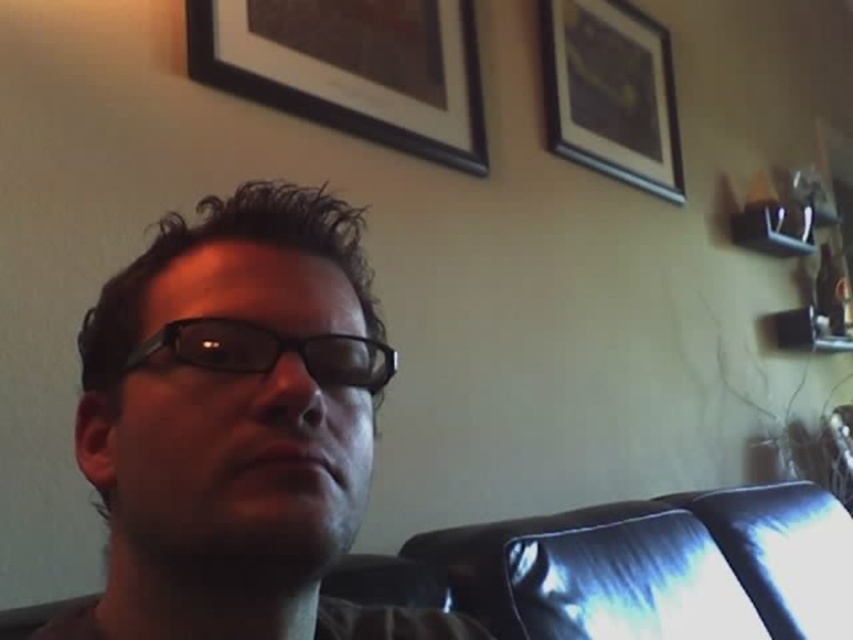
Is matte black glasses at center bigger than wooden picture frame at upper center?

Incorrect, matte black glasses at center is not larger than wooden picture frame at upper center.

Can you confirm if matte black glasses at center is positioned to the left of wooden picture frame at upper center?

Indeed, matte black glasses at center is positioned on the left side of wooden picture frame at upper center.

Who is more forward, [212,264] or [666,195]?

Positioned in front is point [212,264].

Where is `matte black glasses at center`? This screenshot has width=853, height=640. matte black glasses at center is located at coordinates (236, 426).

Who is positioned more to the left, matte black glasses at center or black plastic glasses at center?

Positioned to the left is black plastic glasses at center.

The width and height of the screenshot is (853, 640). I want to click on matte black glasses at center, so click(x=236, y=426).

What are the coordinates of `matte black glasses at center` in the screenshot? It's located at (236, 426).

Which is below, black matte picture frame at upper center or black plastic glasses at center?

black plastic glasses at center

Can you confirm if black matte picture frame at upper center is positioned above black plastic glasses at center?

Indeed, black matte picture frame at upper center is positioned over black plastic glasses at center.

I want to click on black matte picture frame at upper center, so click(352, 67).